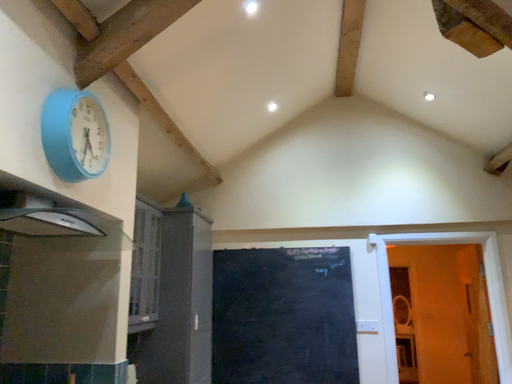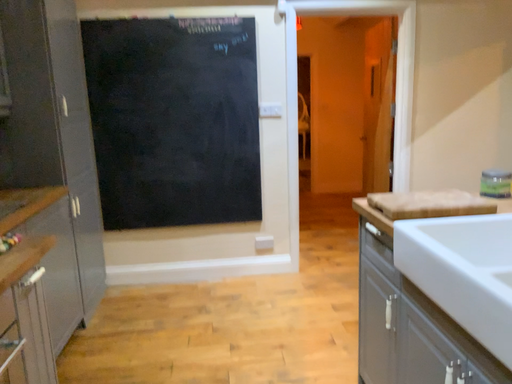
Question: How did the camera likely rotate when shooting the video?

Choices:
 (A) rotated upward
 (B) rotated downward

Answer: (B)